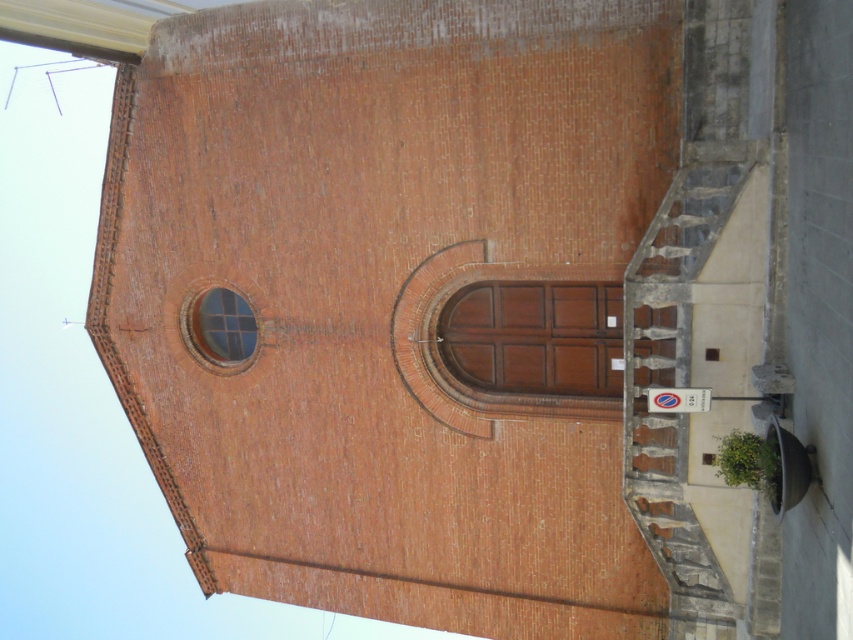
Between matte brown door at center and clear glass window at upper left, which one appears on the left side from the viewer's perspective?

clear glass window at upper left is more to the left.

Between matte brown door at center and clear glass window at upper left, which one has more height?

Standing taller between the two is matte brown door at center.

This screenshot has width=853, height=640. Find the location of `matte brown door at center`. matte brown door at center is located at coordinates pyautogui.click(x=534, y=337).